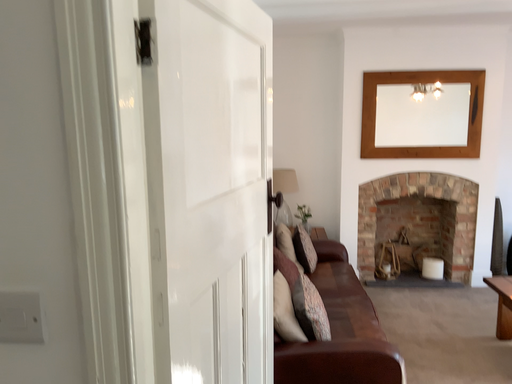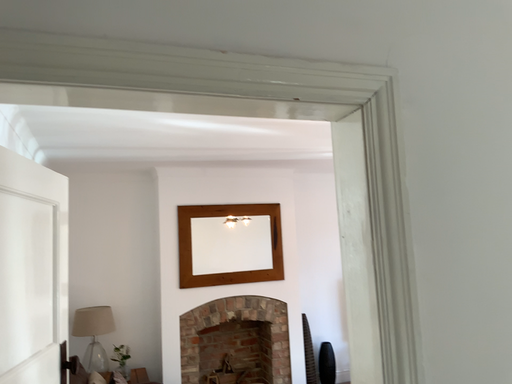
Question: Which way did the camera rotate in the video?

Choices:
 (A) rotated right
 (B) rotated left

Answer: (A)